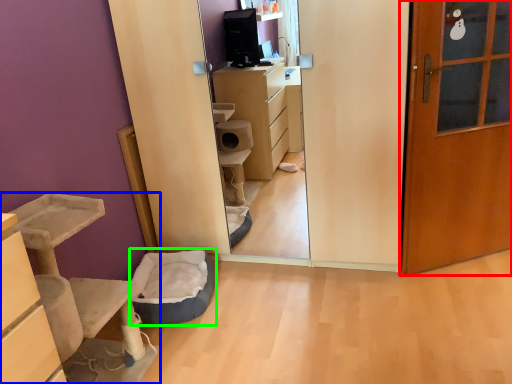
Question: Which object is positioned closest to door (highlighted by a red box)? Select from furniture (highlighted by a blue box) and infant bed (highlighted by a green box).

Choices:
 (A) furniture
 (B) infant bed

Answer: (B)